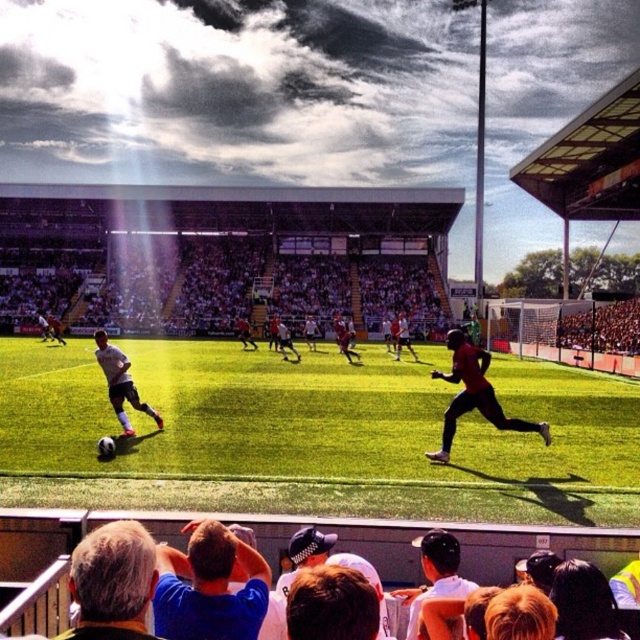
Which of these two, brown hair at center or white matte soccer player at center, stands taller?

Answer: With more height is white matte soccer player at center.

Does point (339, 625) come farther from viewer compared to point (118, 365)?

No, (339, 625) is in front of (118, 365).

Locate an element on the screen. This screenshot has width=640, height=640. brown hair at center is located at coordinates (332, 604).

Between green grass football field at center and brown hair at center, which one appears on the right side from the viewer's perspective?

brown hair at center

Is green grass football field at center to the right of brown hair at center from the viewer's perspective?

No, green grass football field at center is not to the right of brown hair at center.

Find the location of a particular element. green grass football field at center is located at coordinates (314, 422).

Locate an element on the screen. The image size is (640, 640). green grass football field at center is located at coordinates (314, 422).

Can you confirm if blue shirt at lower center is taller than matte red jersey at center?

Incorrect, blue shirt at lower center's height is not larger of matte red jersey at center's.

Is point (182, 628) behind point (529, 429)?

That is False.

Locate an element on the screen. blue shirt at lower center is located at coordinates (209, 586).